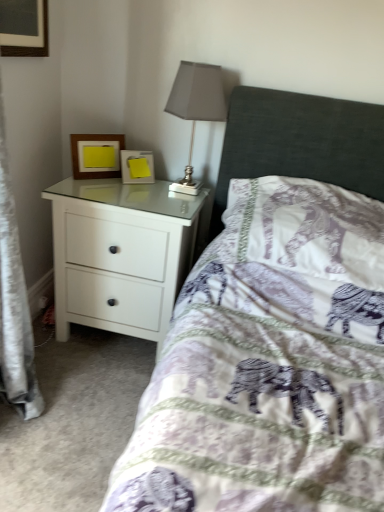
Locate an element on the screen. The width and height of the screenshot is (384, 512). free space in front of yellow paper at upper left, the 2th picture frame when ordered from left to right is located at coordinates 145,195.